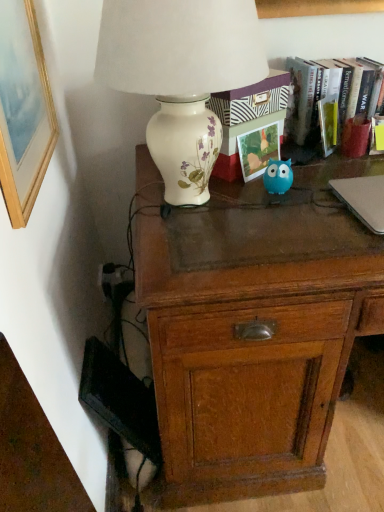
This screenshot has height=512, width=384. What are the coordinates of `vacant area that lies between porcelain floral lamp at upper left and blue rubber toy at center` in the screenshot? It's located at (275, 200).